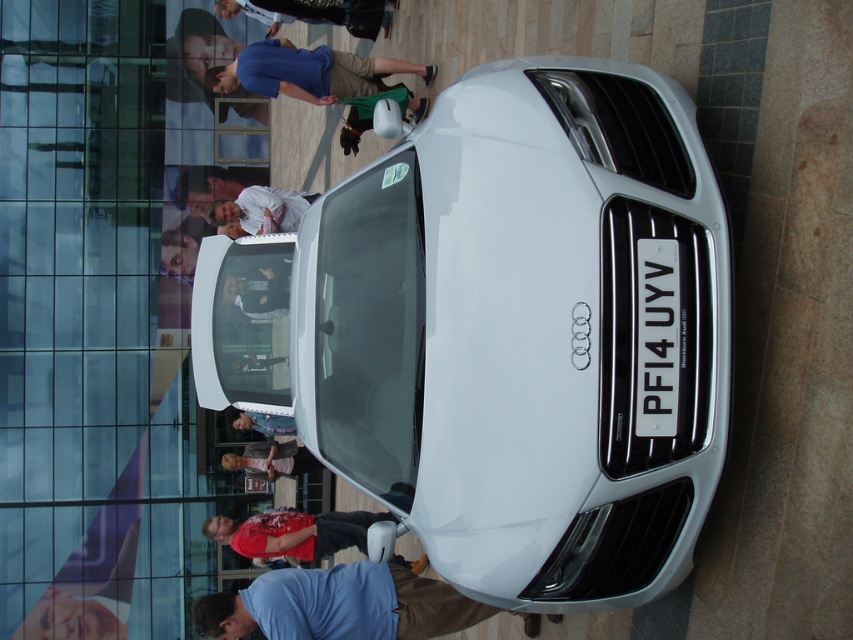
Question: Can you confirm if white glossy car at center is bigger than white cotton shirt at center?

Choices:
 (A) no
 (B) yes

Answer: (B)

Question: Which point is farther to the camera?

Choices:
 (A) smooth skin hand at lower center
 (B) light pink fabric shirt at center

Answer: (A)

Question: Where is matte blue shirt at upper center located in relation to blue denim jeans at center in the image?

Choices:
 (A) below
 (B) above

Answer: (B)

Question: Which point is closer to the camera taking this photo?

Choices:
 (A) (332, 196)
 (B) (248, 424)

Answer: (A)

Question: Which object is farther from the camera taking this photo?

Choices:
 (A) blue denim jeans at center
 (B) red t-shirt at lower center
 (C) smooth skin hand at lower center
 (D) white glossy car at center

Answer: (C)

Question: Is blue fabric shirt at lower center to the right of red t-shirt at lower center from the viewer's perspective?

Choices:
 (A) yes
 (B) no

Answer: (A)